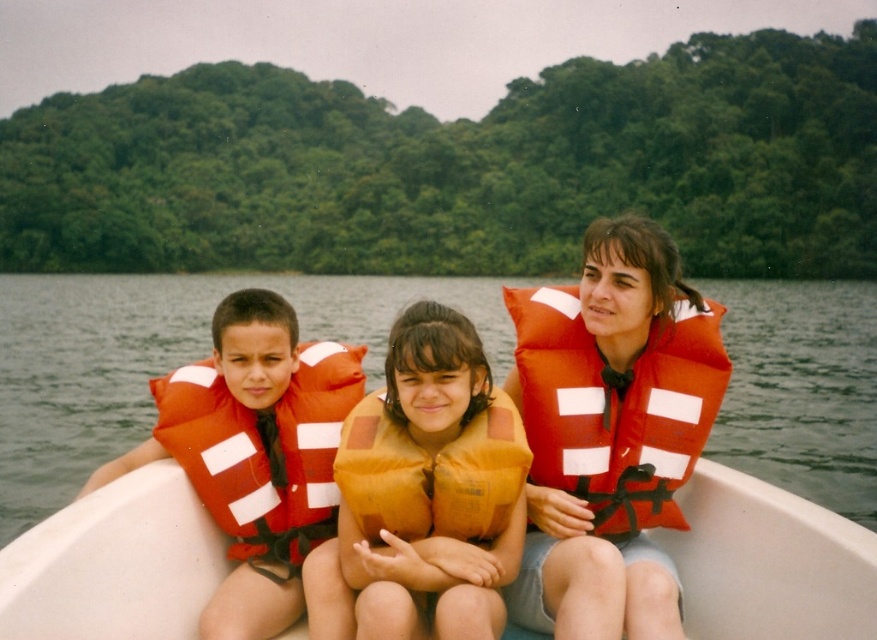
You are a safety inspector checking the distance between the white plastic boat at center and the orange fabric life vest at center. According to safety regulations, the distance between a boat and any life vest must be less than 1.5 meters. Is the current distance compliant?

The white plastic boat at center is 1.27 meters away from the orange fabric life vest at center, which is within the required distance of less than 1.5 meters. Therefore, the current distance is compliant with safety regulations.

You are a photographer trying to capture a clear shot of the orange fabric life vest at center and the white plastic boat at center. Since you want the life vest to be the main focus, which object should you position closer to the camera to ensure it appears larger in the photo?

To make the orange fabric life vest at center appear larger in the photo, you should position it closer to the camera since it is shorter than the white plastic boat at center. This way, its size in the frame will be emphasized despite its smaller physical height.